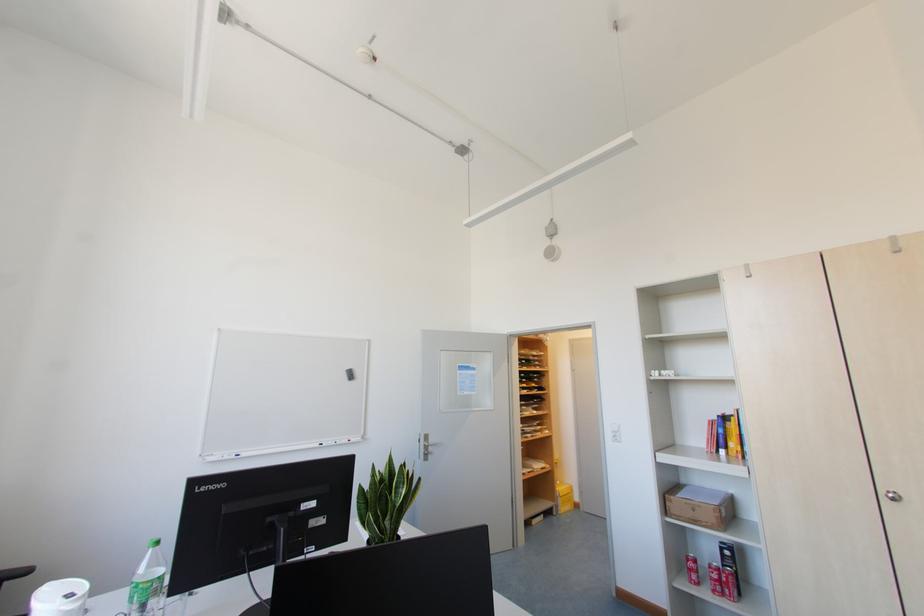
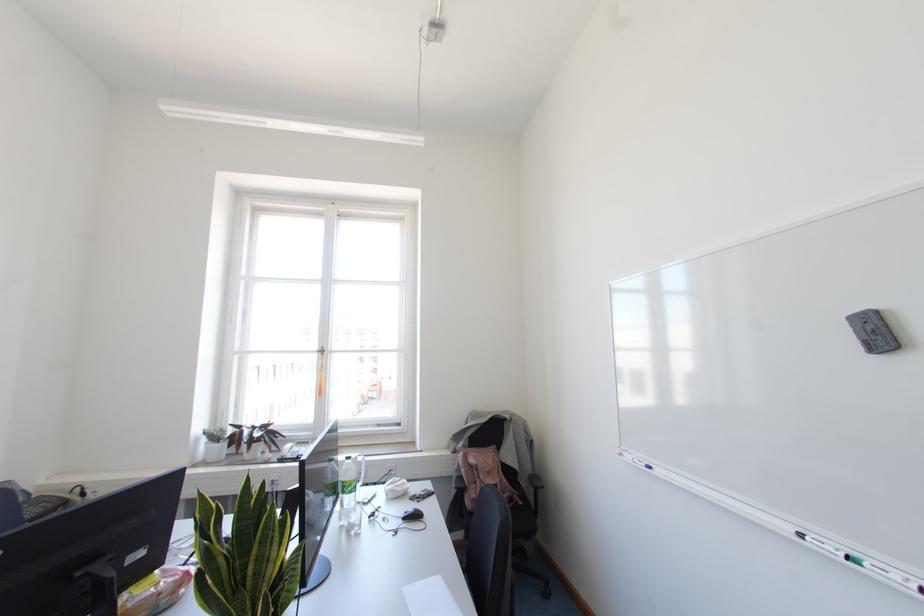
Where in the second image is the point corresponding to point (321, 444) from the first image?

(800, 536)